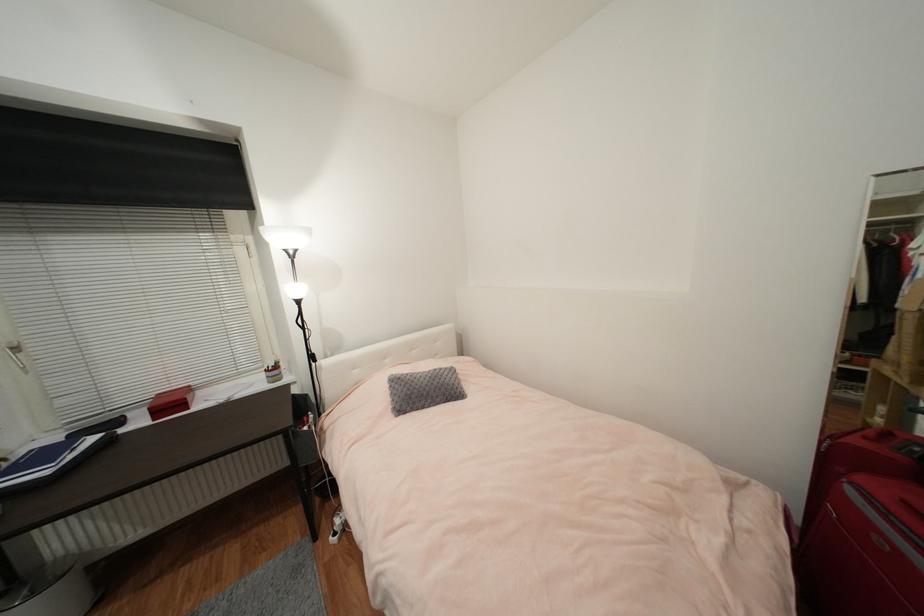
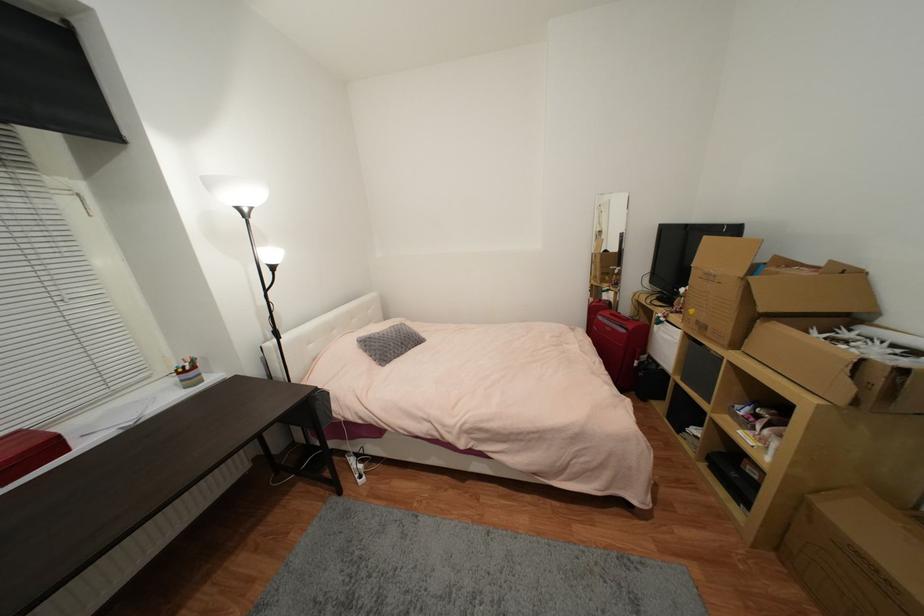
In the second image, find the point that corresponds to point (855, 492) in the first image.

(603, 318)